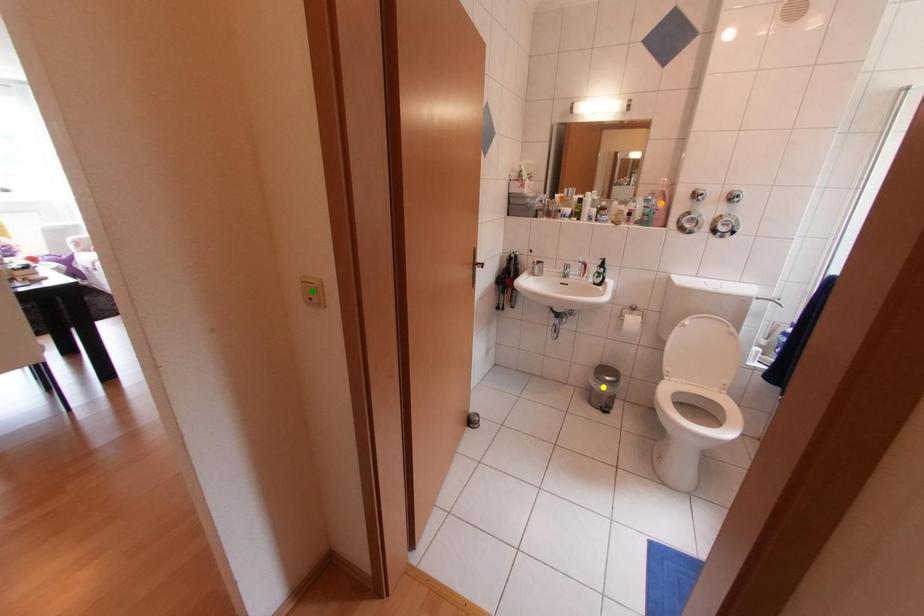
Order these from nearest to farthest:
- green point
- yellow point
- orange point

yellow point, orange point, green point